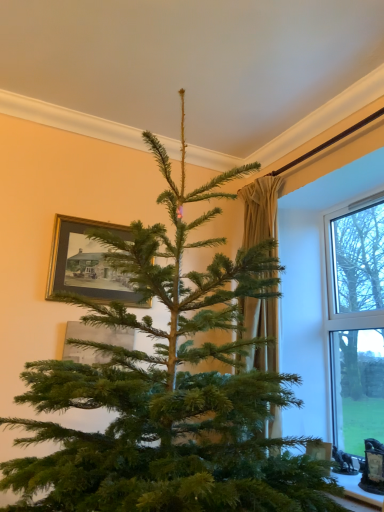
Question: Is gold-framed picture at upper left, the 2th picture frame from the bottom, taller or shorter than white plastic window at right?

Choices:
 (A) short
 (B) tall

Answer: (A)

Question: From a real-world perspective, is gold-framed picture at upper left, positioned as the 1th picture frame in top-to-bottom order, positioned above or below white plastic window at right?

Choices:
 (A) above
 (B) below

Answer: (A)

Question: Based on their relative distances, which object is farther from the white plastic window at right?

Choices:
 (A) gold-framed picture at upper left, placed as the second picture frame when sorted from top to bottom
 (B) transparent glass window at right
 (C) beige fabric curtain at center
 (D) gold-framed picture at upper left, positioned as the 1th picture frame in top-to-bottom order

Answer: (A)

Question: Based on their relative distances, which object is nearer to the transparent glass window at right?

Choices:
 (A) gold-framed picture at upper left, the 2th picture frame from the bottom
 (B) white plastic window at right
 (C) gold-framed picture at upper left, placed as the second picture frame when sorted from top to bottom
 (D) beige fabric curtain at center

Answer: (B)